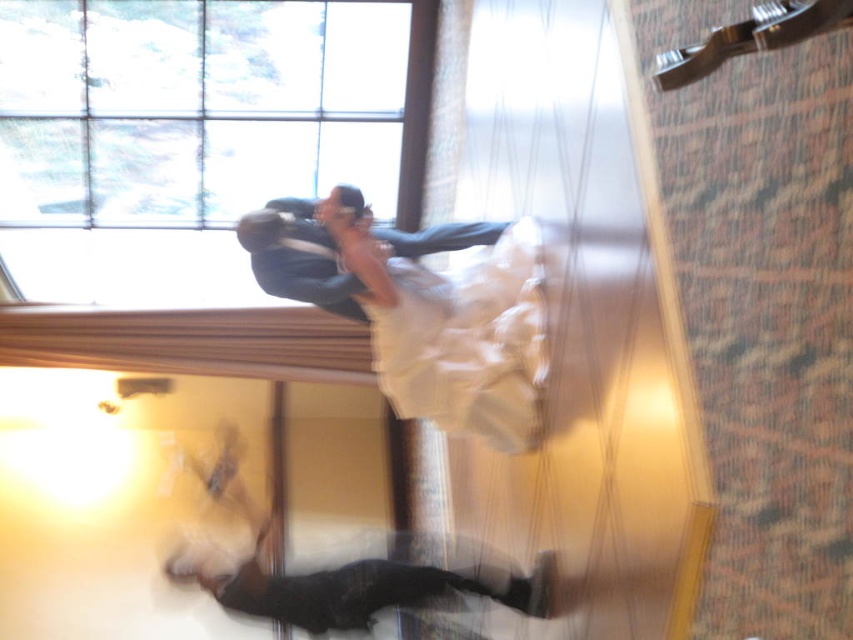
Looking at this image, you are standing in the wedding celebration room and want to move from the point at coordinates point (448, 428) to the point at coordinates point (445, 243). Can you walk directly between them without any obstacles?

Point (448, 428) is in front of point (445, 243), so there is no obstacle between them. You can walk directly between them.

You are a photographer at the wedding and want to capture a photo of the white satin dress at center and the shiny dark blue suit at upper center. Based on their heights, which one should you focus on first to ensure both are in frame?

The white satin dress at center is taller than the shiny dark blue suit at upper center, so you should focus on the white satin dress at center first to ensure both are in frame.